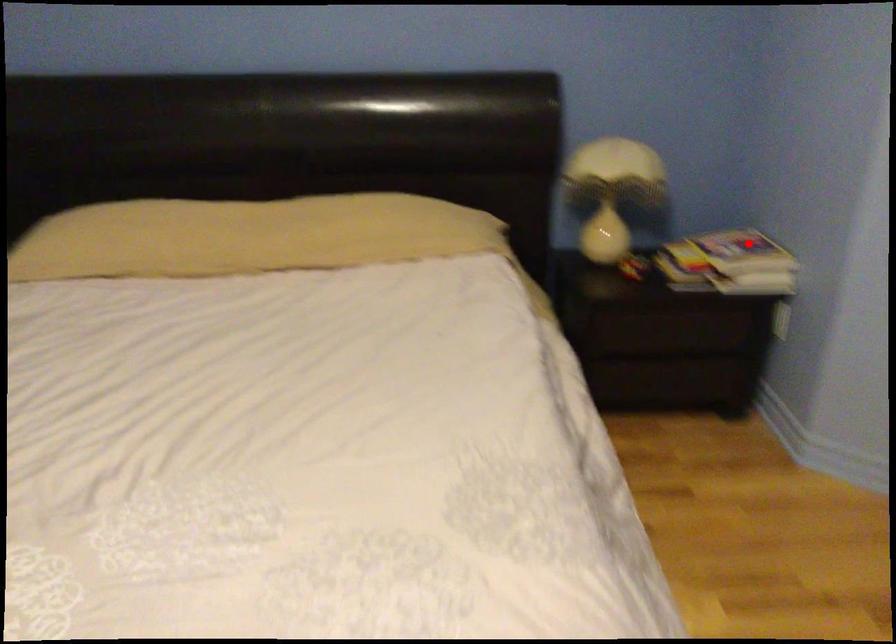
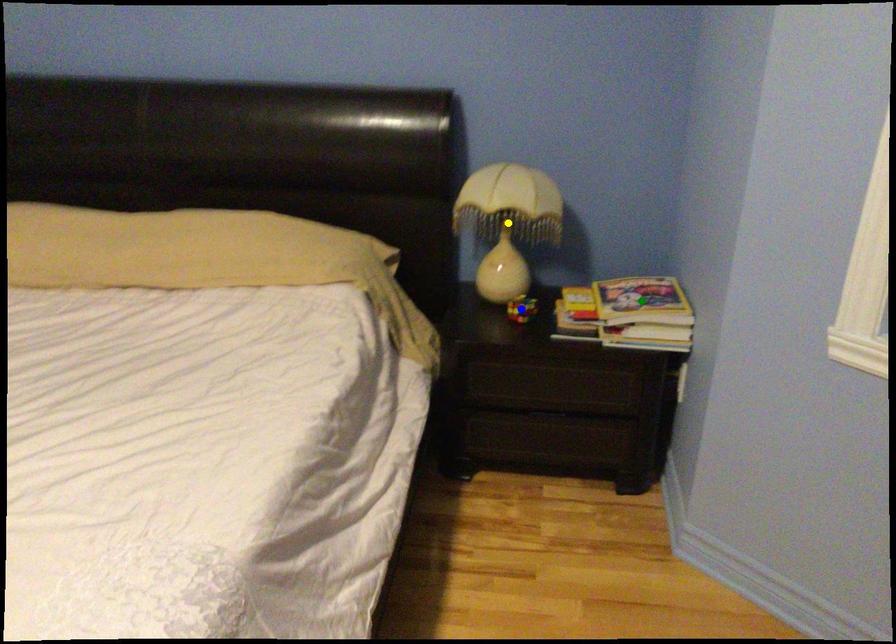
Question: I am providing you with two images of the same scene from different viewpoints. A red point is marked on the first image. You are given multiple points on the second image. Which point in image 2 is actually the same real-world point as the red point in image 1?

Choices:
 (A) blue point
 (B) green point
 (C) yellow point

Answer: (B)